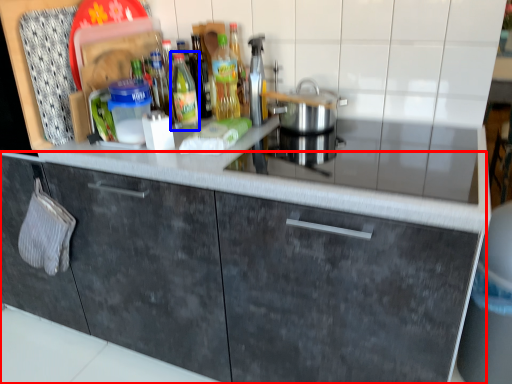
Question: Which object appears closest to the camera in this image, cabinetry (highlighted by a red box) or bottle (highlighted by a blue box)?

Choices:
 (A) cabinetry
 (B) bottle

Answer: (A)